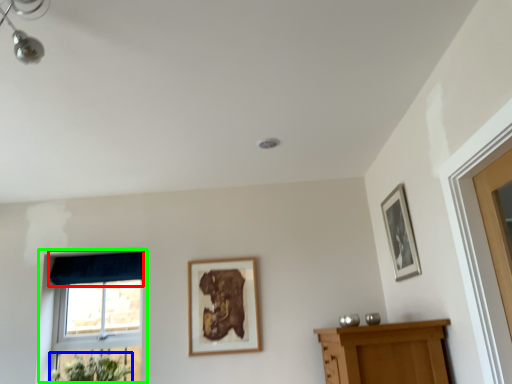
Question: Considering the real-world distances, which object is closest to curtain (highlighted by a red box)? flower (highlighted by a blue box) or window (highlighted by a green box).

Choices:
 (A) flower
 (B) window

Answer: (B)